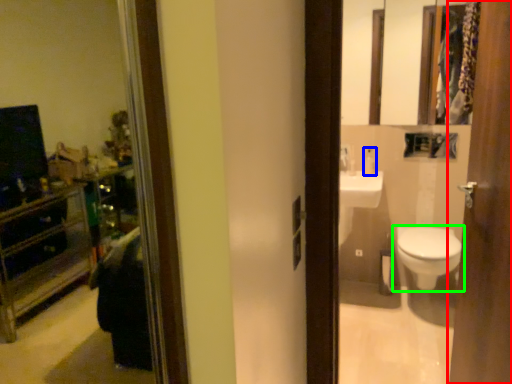
Question: Which object is positioned farthest from door (highlighted by a red box)? Select from toiletry (highlighted by a blue box) and toilet (highlighted by a green box).

Choices:
 (A) toiletry
 (B) toilet

Answer: (A)